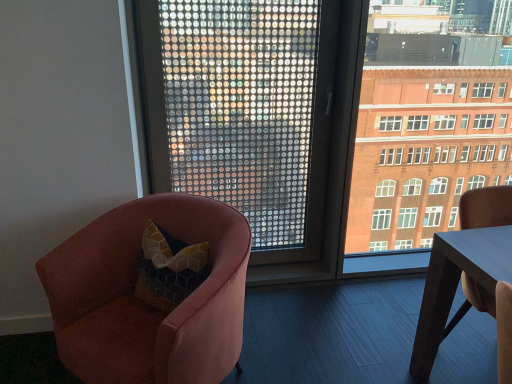
Question: Considering the relative positions of smooth wooden table at right and brick building at right in the image provided, is smooth wooden table at right to the right of brick building at right from the viewer's perspective?

Choices:
 (A) no
 (B) yes

Answer: (B)

Question: Is smooth wooden table at right smaller than brick building at right?

Choices:
 (A) yes
 (B) no

Answer: (A)

Question: From the image's perspective, would you say smooth wooden table at right is shown under brick building at right?

Choices:
 (A) no
 (B) yes

Answer: (B)

Question: Is smooth wooden table at right bigger than brick building at right?

Choices:
 (A) no
 (B) yes

Answer: (A)

Question: Does smooth wooden table at right appear on the left side of brick building at right?

Choices:
 (A) no
 (B) yes

Answer: (A)

Question: Does smooth wooden table at right have a greater height compared to brick building at right?

Choices:
 (A) yes
 (B) no

Answer: (B)

Question: Are brick building at right and velvet pink armchair at left located far from each other?

Choices:
 (A) no
 (B) yes

Answer: (B)

Question: Is brick building at right completely or partially outside of velvet pink armchair at left?

Choices:
 (A) no
 (B) yes

Answer: (B)

Question: Does brick building at right appear on the right side of velvet pink armchair at left?

Choices:
 (A) yes
 (B) no

Answer: (A)

Question: Considering the relative sizes of brick building at right and velvet pink armchair at left in the image provided, is brick building at right wider than velvet pink armchair at left?

Choices:
 (A) no
 (B) yes

Answer: (A)

Question: Is brick building at right further to the viewer compared to velvet pink armchair at left?

Choices:
 (A) no
 (B) yes

Answer: (B)

Question: From a real-world perspective, is brick building at right over velvet pink armchair at left?

Choices:
 (A) yes
 (B) no

Answer: (A)

Question: Are velvet pink armchair at left and brick building at right far apart?

Choices:
 (A) no
 (B) yes

Answer: (B)